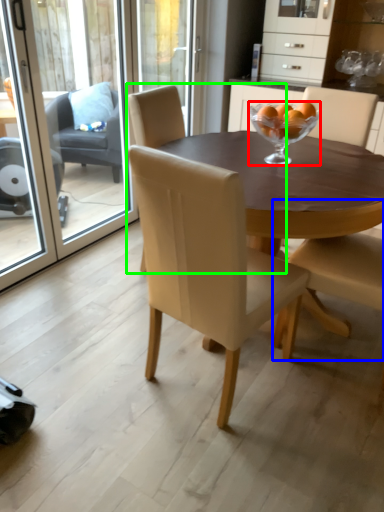
Question: Which object is the farthest from martini glass (highlighted by a red box)? Choose among these: chair (highlighted by a blue box) or chair (highlighted by a green box).

Choices:
 (A) chair
 (B) chair

Answer: (B)